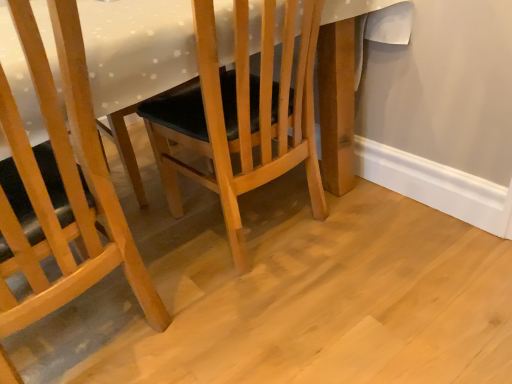
This screenshot has height=384, width=512. I want to click on free space in front of wooden chair at center, which is the first chair from right to left, so click(328, 325).